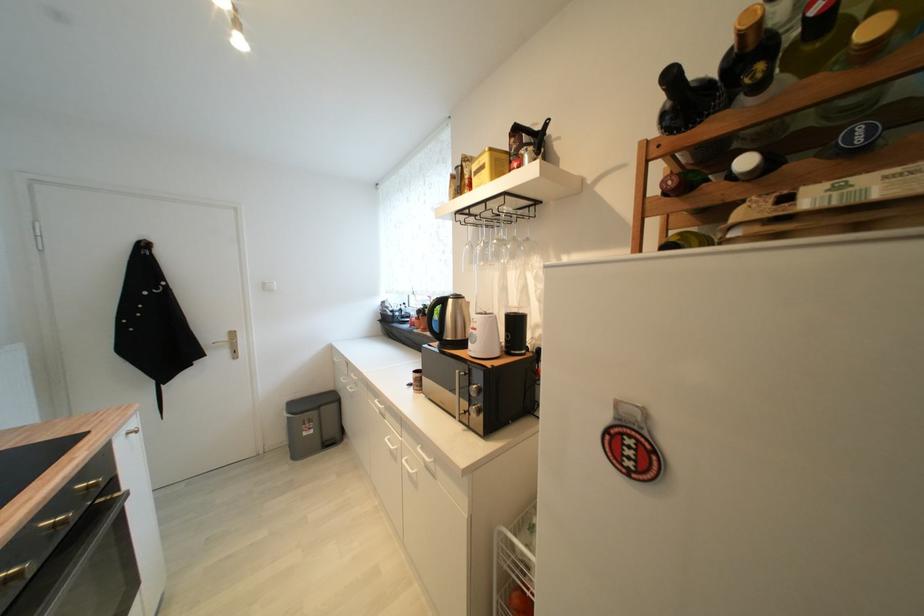
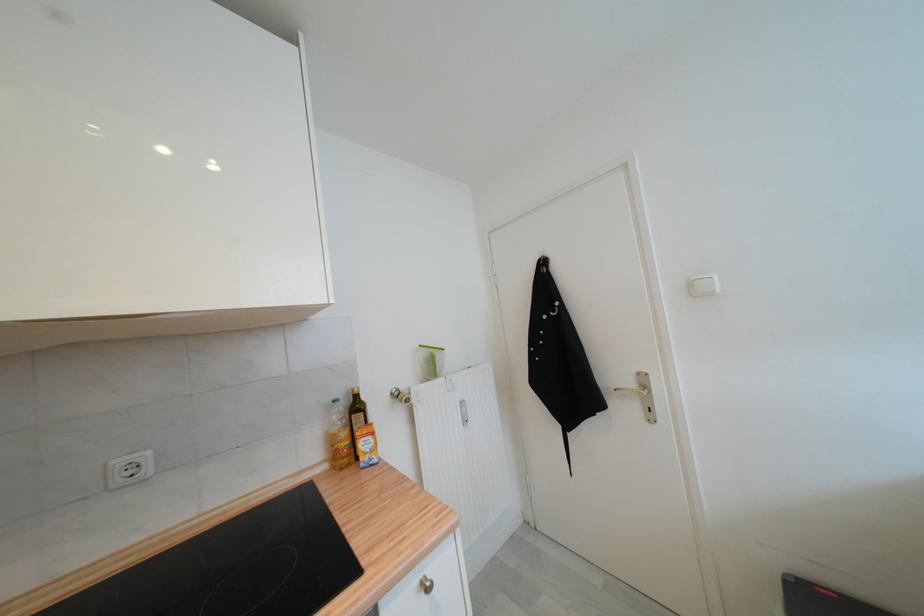
In the second image, find the point that corresponds to (229,339) in the first image.

(637, 386)